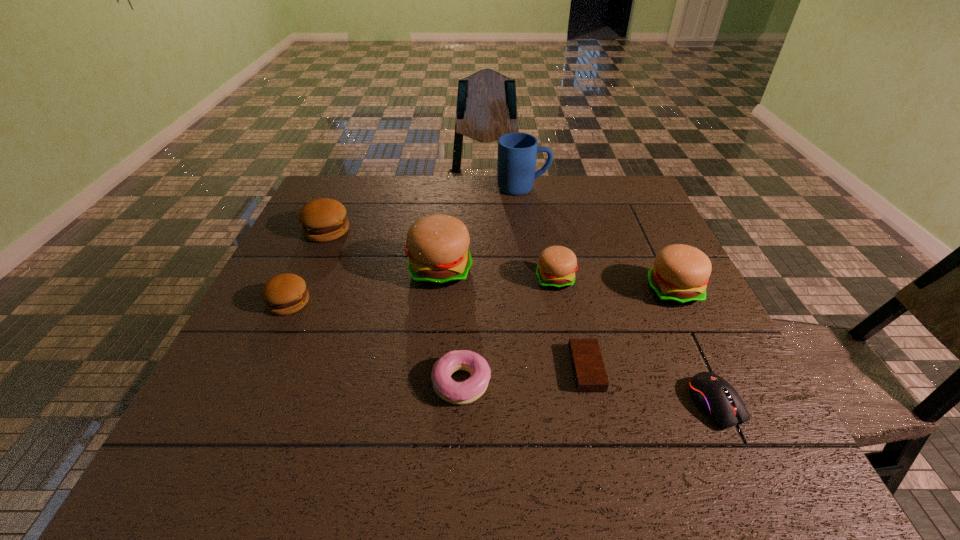
Image resolution: width=960 pixels, height=540 pixels. In order to click on computer mouse that is at the right edge in this screenshot , I will do `click(711, 393)`.

Where is `object that is at the near right corner`? The width and height of the screenshot is (960, 540). object that is at the near right corner is located at coordinates pos(711,393).

In the image, there is a desktop. Identify the location of free region at the far edge. (470, 179).

The width and height of the screenshot is (960, 540). Identify the location of free space at the near edge of the desktop. (603, 438).

I want to click on vacant region at the left edge of the desktop, so click(x=298, y=363).

In the image, there is a desktop. Where is `vacant space at the right edge`? The height and width of the screenshot is (540, 960). vacant space at the right edge is located at coordinates (699, 354).

At what (x,y) coordinates should I click in order to perform the action: click on vacant space at the far left corner of the desktop. Please return your answer as a coordinate pair (x, y). The width and height of the screenshot is (960, 540). Looking at the image, I should click on (328, 176).

Locate an element on the screen. The image size is (960, 540). free location at the near right corner of the desktop is located at coordinates (774, 464).

The image size is (960, 540). Identify the location of free space between the pink doughnut and the shortest hamburger. (375, 343).

At what (x,y) coordinates should I click in order to perform the action: click on vacant area that lies between the farther brown hamburger and the computer mouse. Please return your answer as a coordinate pair (x, y). This screenshot has height=540, width=960. Looking at the image, I should click on (521, 317).